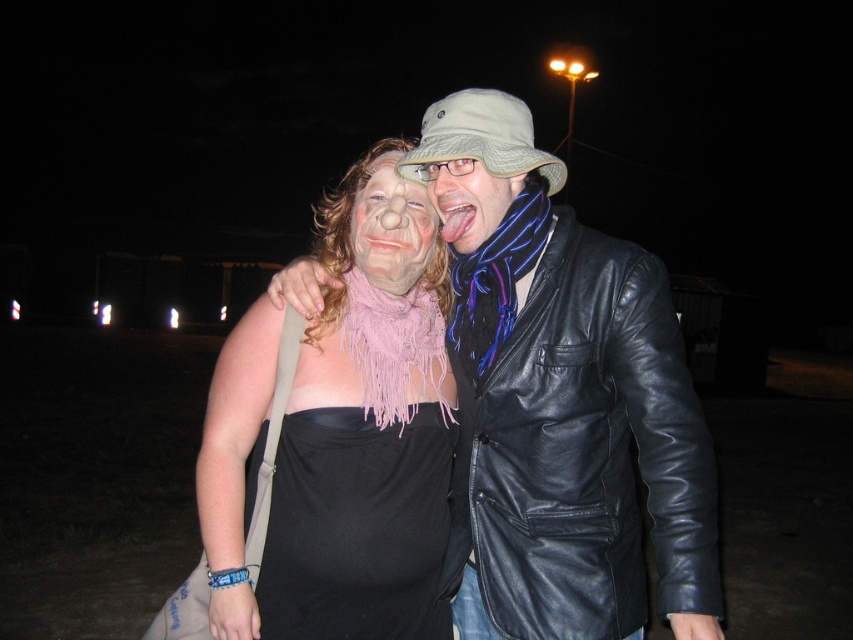
Question: Which of the following is the closest to the observer?

Choices:
 (A) (491, 465)
 (B) (250, 397)

Answer: (A)

Question: Does black matte dress at center have a larger size compared to matte black jacket at center?

Choices:
 (A) yes
 (B) no

Answer: (A)

Question: Which object is farther from the camera taking this photo?

Choices:
 (A) pink fabric mask at center
 (B) matte black jacket at center
 (C) black matte dress at center

Answer: (A)

Question: Can you confirm if pink fringed scarf at center is positioned to the right of black matte dress at center?

Choices:
 (A) no
 (B) yes

Answer: (A)

Question: Estimate the real-world distances between objects in this image. Which object is farther from the black matte dress at center?

Choices:
 (A) pink fringed scarf at center
 (B) pink fabric mask at center
 (C) matte black jacket at center
 (D) black leather jacket at right

Answer: (C)

Question: Is black leather jacket at center thinner than pink fabric mask at center?

Choices:
 (A) no
 (B) yes

Answer: (A)